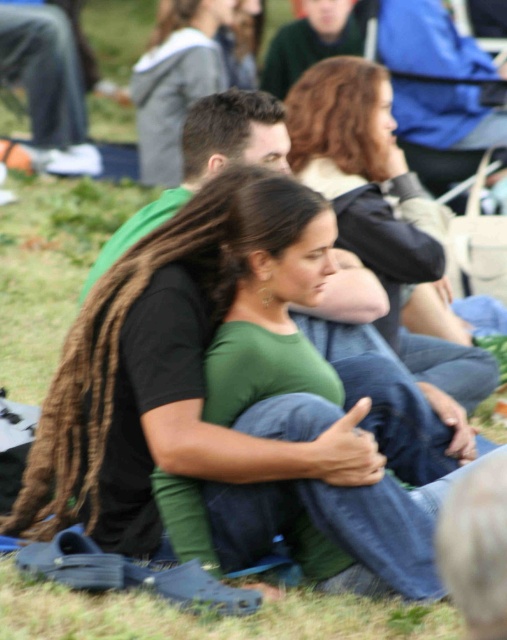
Question: Is green grass at lower center above green fabric pants at lower left?

Choices:
 (A) yes
 (B) no

Answer: (B)

Question: Is the position of black matte shirt at center less distant than that of green fabric pants at lower left?

Choices:
 (A) yes
 (B) no

Answer: (A)

Question: Is green grass at lower center positioned at the back of green fabric pants at lower left?

Choices:
 (A) yes
 (B) no

Answer: (B)

Question: Which object is the closest to the green matte shirt at center?

Choices:
 (A) black matte shirt at center
 (B) green matte shirt at upper center

Answer: (B)

Question: Which of the following is the farthest from the observer?

Choices:
 (A) black matte shirt at center
 (B) green grass at lower center
 (C) green fabric pants at lower left

Answer: (C)

Question: Among these objects, which one is nearest to the camera?

Choices:
 (A) green matte shirt at center
 (B) green fabric pants at lower left
 (C) green grass at lower center
 (D) green matte shirt at upper center

Answer: (C)